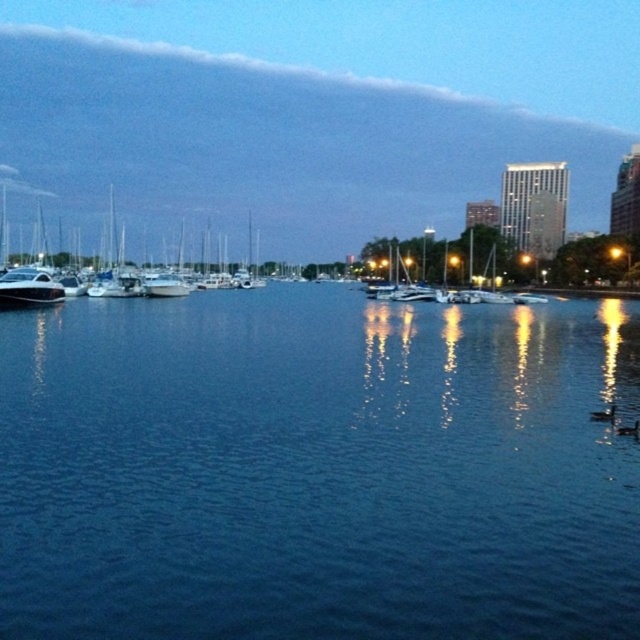
Question: Among these objects, which one is nearest to the camera?

Choices:
 (A) blue water at center
 (B) white glossy boat at left

Answer: (A)

Question: Which of these objects is positioned closest to the white glossy boat at left?

Choices:
 (A) shiny white sailboat at center
 (B) blue water at center

Answer: (A)

Question: Which point is farther to the camera?

Choices:
 (A) blue water at center
 (B) shiny white yacht at left
 (C) white glossy boat at left
 (D) shiny white sailboat at center

Answer: (D)

Question: Can you confirm if blue water at center is positioned above white glossy boat at left?

Choices:
 (A) yes
 (B) no

Answer: (B)

Question: Where is shiny white sailboat at center located in relation to shiny white yacht at left in the image?

Choices:
 (A) right
 (B) left

Answer: (A)

Question: Is blue water at center positioned before white glossy boat at left?

Choices:
 (A) no
 (B) yes

Answer: (B)